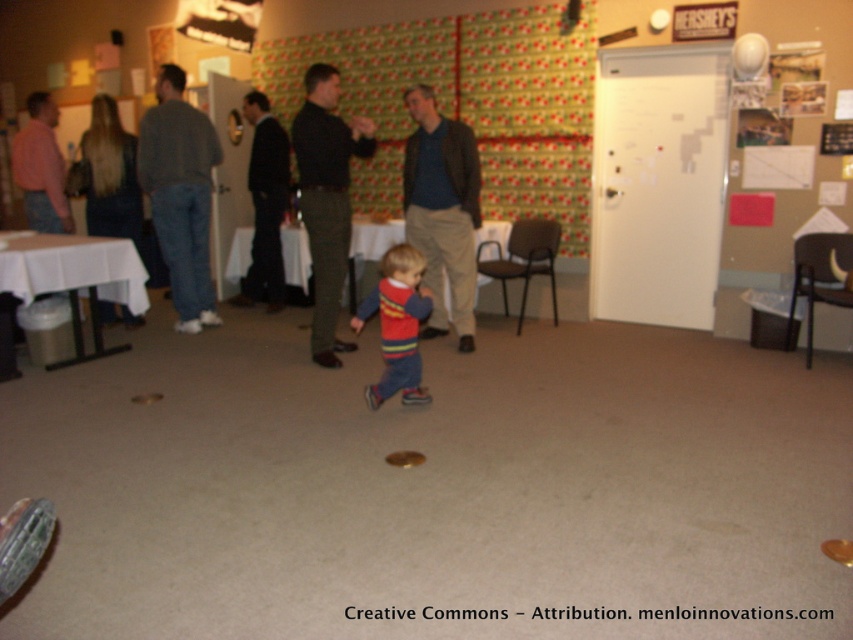
Question: Does gray sweater at left have a smaller size compared to matte brown jacket at center?

Choices:
 (A) yes
 (B) no

Answer: (B)

Question: Which point is farther to the camera?

Choices:
 (A) matte red sweater at center
 (B) gray sweater at left
 (C) matte pink shirt at left
 (D) dark green textured pants at center

Answer: (C)

Question: Which object is the farthest from the gray sweater at left?

Choices:
 (A) matte red sweater at center
 (B) dark suit at center
 (C) matte pink shirt at left

Answer: (A)

Question: Which object appears closest to the camera in this image?

Choices:
 (A) matte red sweater at center
 (B) matte brown jacket at center
 (C) gray sweater at left
 (D) dark suit at center

Answer: (A)

Question: Considering the relative positions of matte brown jacket at center and matte red sweater at center in the image provided, where is matte brown jacket at center located with respect to matte red sweater at center?

Choices:
 (A) below
 (B) above

Answer: (B)

Question: Can you confirm if matte brown jacket at center is wider than matte pink shirt at left?

Choices:
 (A) yes
 (B) no

Answer: (B)